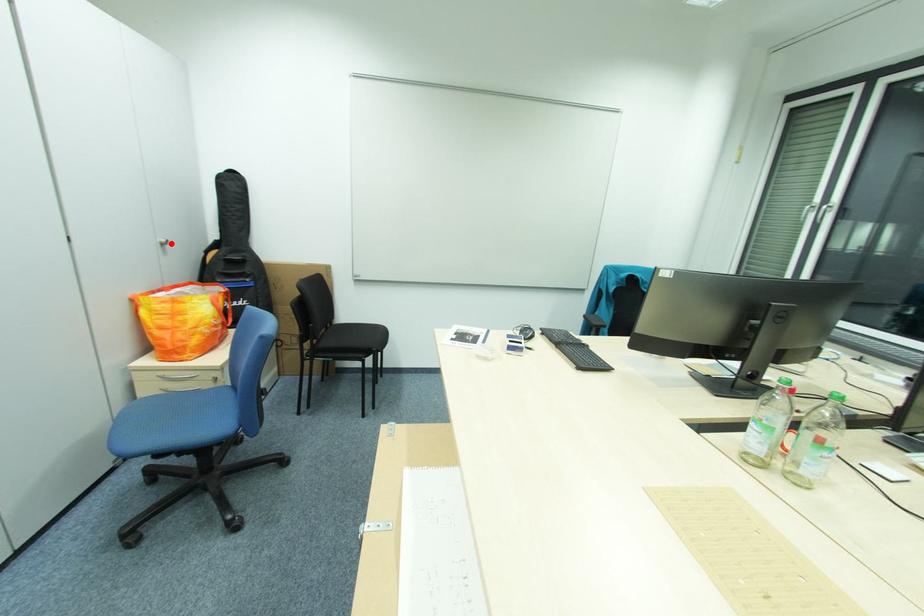
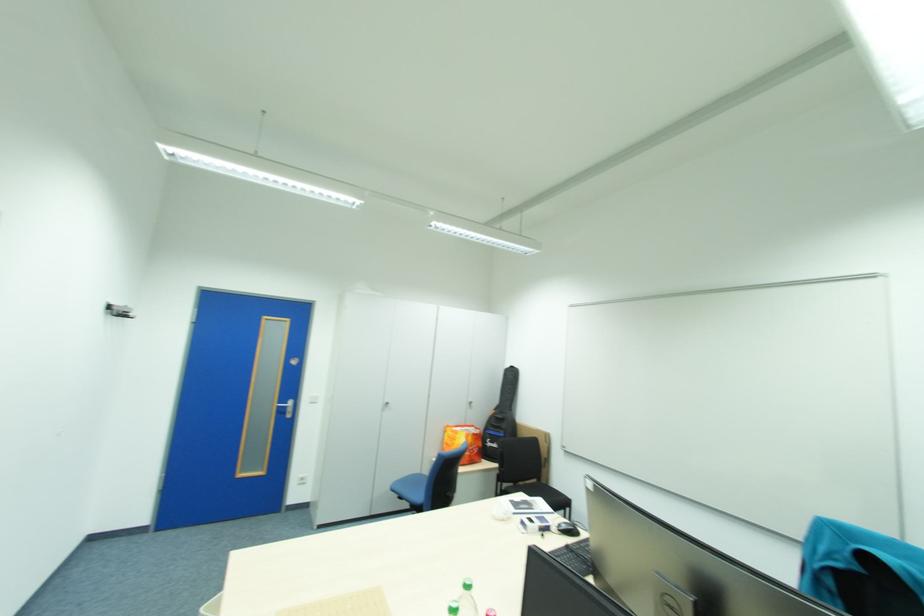
Locate, in the second image, the point that corresponds to the highlighted location in the first image.

(479, 403)